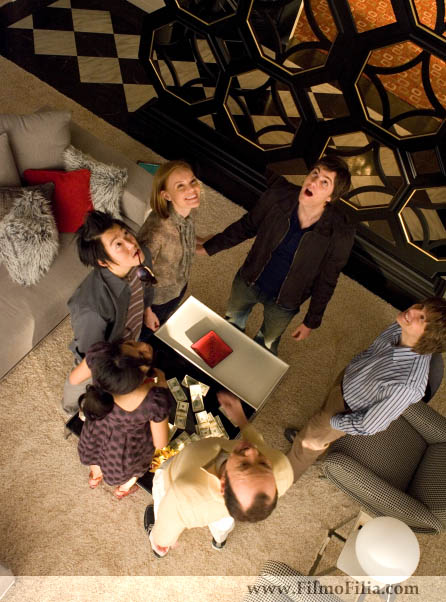
Locate an element on the screen. This screenshot has width=446, height=602. carpet is located at coordinates (293, 405).